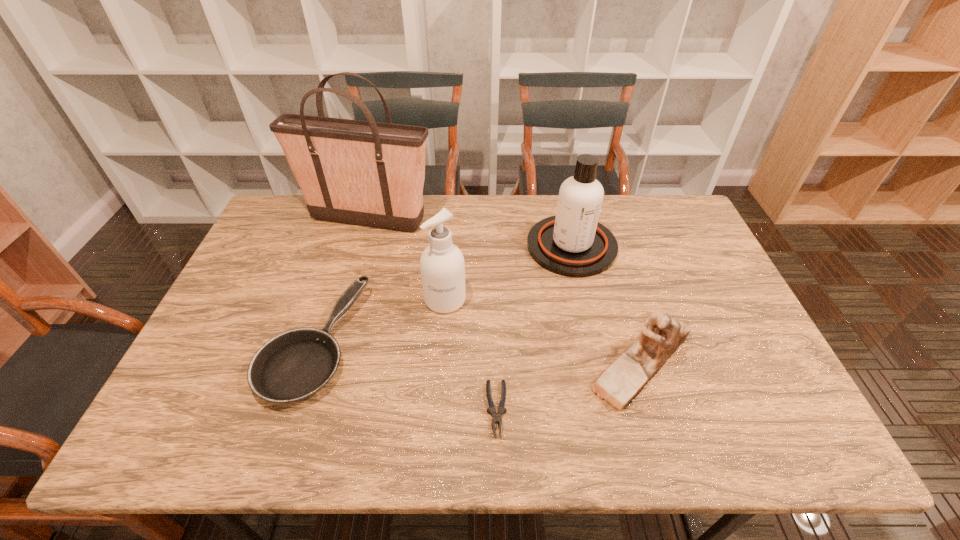
Where is `vacant space in between the shortest object and the frying pan`? The height and width of the screenshot is (540, 960). vacant space in between the shortest object and the frying pan is located at coordinates (405, 376).

Identify the location of object that is the fifth closest to the farther cleansing agent. Image resolution: width=960 pixels, height=540 pixels. (294, 365).

Image resolution: width=960 pixels, height=540 pixels. In order to click on the third closest object to the frying pan in this screenshot , I will do (x=497, y=416).

Locate an element on the screen. The image size is (960, 540). vacant space that satisfies the following two spatial constraints: 1. on the front side of the right cleansing agent; 2. on the left side of the tallest object is located at coordinates 360,246.

Locate an element on the screen. free space in the image that satisfies the following two spatial constraints: 1. on the front-facing side of the third shortest object; 2. at the gripping part of the fourth object from left to right is located at coordinates (656, 409).